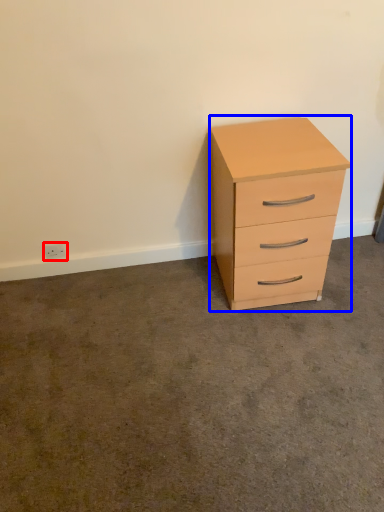
Question: Which point is closer to the camera, electric outlet (highlighted by a red box) or chest of drawers (highlighted by a blue box)?

Choices:
 (A) electric outlet
 (B) chest of drawers

Answer: (B)